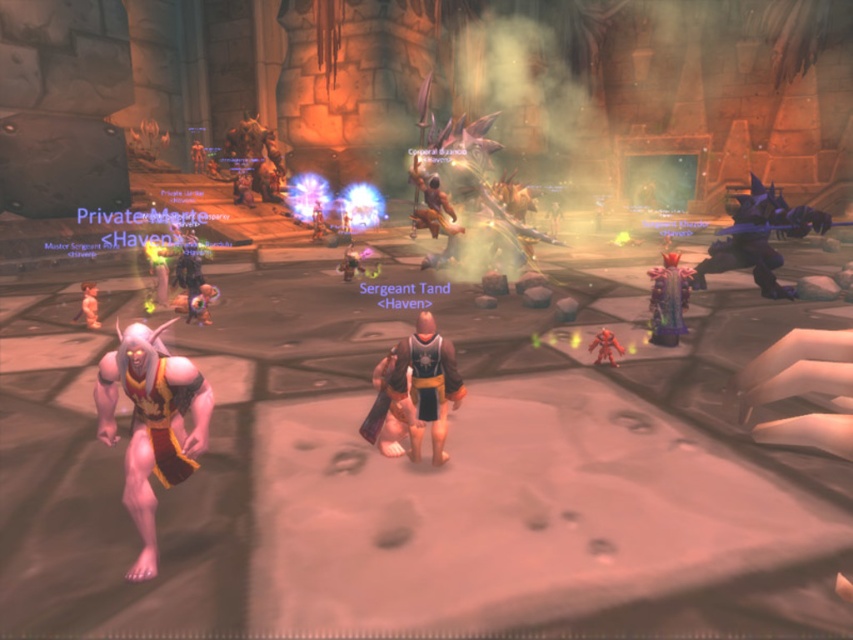
Question: Which object appears farthest from the camera in this image?

Choices:
 (A) shiny red toy at lower right
 (B) orange fabric demon at lower left
 (C) shiny plastic toy at center
 (D) brown leather belt at center

Answer: (C)

Question: Is shiny purple crystal at right smaller than shiny plastic toy at center?

Choices:
 (A) no
 (B) yes

Answer: (A)

Question: Can you confirm if brown leather belt at center is positioned below shiny red toy at lower right?

Choices:
 (A) yes
 (B) no

Answer: (A)

Question: Which is nearer to the matte orange toy at lower left?

Choices:
 (A) shiny purple crystal at right
 (B) orange fabric demon at lower left

Answer: (B)

Question: From the image, what is the correct spatial relationship of matte orange toy at lower left in relation to shiny red toy at lower right?

Choices:
 (A) left
 (B) right

Answer: (A)

Question: Which of the following is the farthest from the observer?

Choices:
 (A) shiny blue armor at right
 (B) shiny plastic toy at center

Answer: (A)